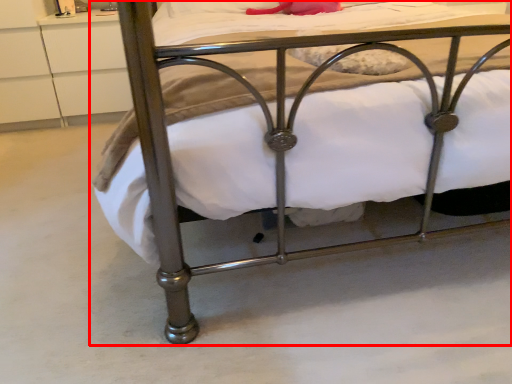
Question: From the image's perspective, what is the correct spatial relationship of bed (annotated by the red box) in relation to drawer?

Choices:
 (A) above
 (B) below

Answer: (B)